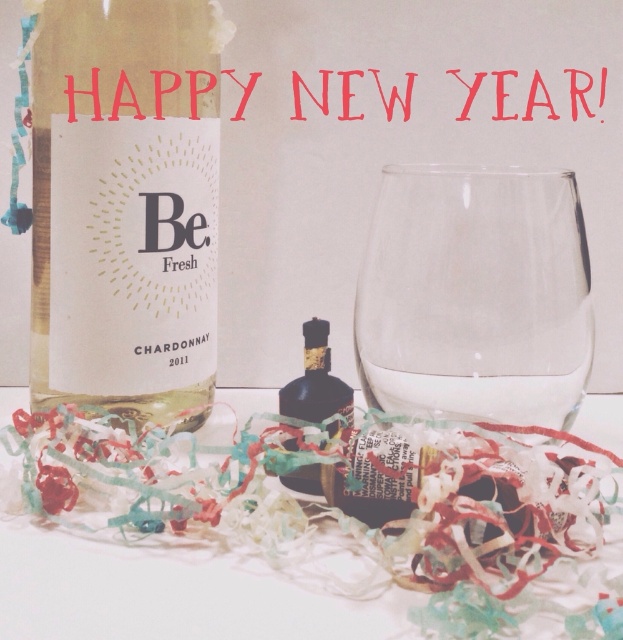
Question: Which point is farther to the camera?

Choices:
 (A) (202, 625)
 (B) (285, 481)
 (C) (449, 216)

Answer: (B)

Question: Which object appears closest to the camera in this image?

Choices:
 (A) white paper at center
 (B) white matte bottle at left
 (C) shiny dark glass bottle at center

Answer: (A)

Question: From the image, what is the correct spatial relationship of transparent glass at center in relation to white paper at center?

Choices:
 (A) left
 (B) right

Answer: (B)

Question: Which point is closer to the camera?

Choices:
 (A) (366, 611)
 (B) (34, 378)
 (C) (320, 417)
 (D) (492, 276)

Answer: (A)

Question: Is white matte bottle at left further to camera compared to shiny dark glass bottle at center?

Choices:
 (A) no
 (B) yes

Answer: (B)

Question: Considering the relative positions of white matte bottle at left and transparent glass at center in the image provided, where is white matte bottle at left located with respect to transparent glass at center?

Choices:
 (A) right
 (B) left

Answer: (B)